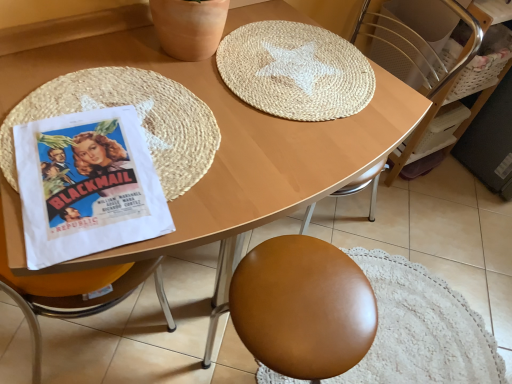
Question: From the image's perspective, is white paper poster at left positioned above or below natural fiber mat at upper center, the second mat positioned from the left?

Choices:
 (A) below
 (B) above

Answer: (A)

Question: Considering the positions of white paper poster at left and natural fiber mat at upper center, arranged as the first mat when viewed from the right, in the image, is white paper poster at left wider or thinner than natural fiber mat at upper center, arranged as the first mat when viewed from the right,?

Choices:
 (A) thin
 (B) wide

Answer: (A)

Question: Which object is the closest to the woven straw placemat at left, which ranks as the 2th mat in right-to-left order?

Choices:
 (A) wooden at upper center
 (B) white woven basket at upper right
 (C) white paper poster at left
 (D) natural fiber mat at upper center, the second mat positioned from the left

Answer: (C)

Question: Which object is the closest to the white paper poster at left?

Choices:
 (A) woven straw placemat at left, which ranks as the 2th mat in right-to-left order
 (B) wooden at upper center
 (C) white woven basket at upper right
 (D) natural fiber mat at upper center, arranged as the first mat when viewed from the right

Answer: (A)